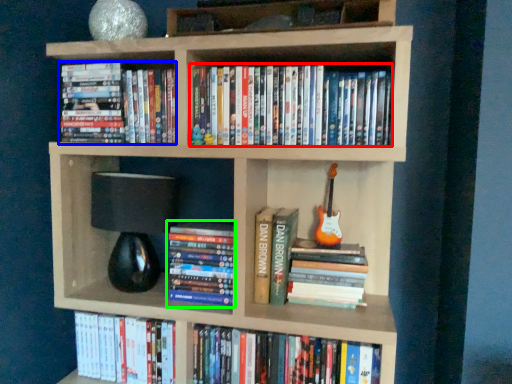
Question: Considering the real-world distances, which object is closest to book (highlighted by a red box)? book (highlighted by a blue box) or book (highlighted by a green box).

Choices:
 (A) book
 (B) book

Answer: (A)